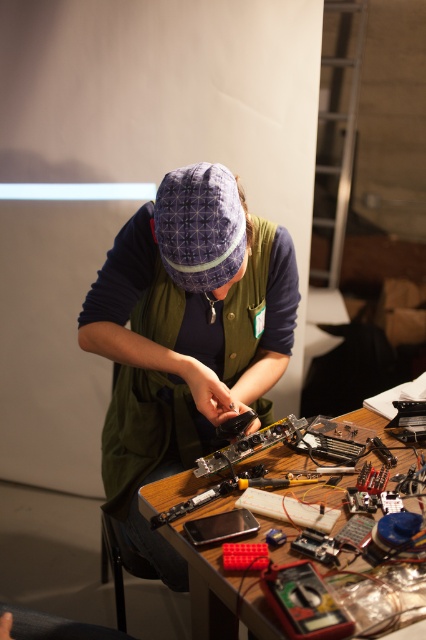
Question: Where is purple fabric cap at upper center located in relation to wooden table at center in the image?

Choices:
 (A) below
 (B) above

Answer: (B)

Question: Where is purple fabric cap at upper center located in relation to wooden table at center in the image?

Choices:
 (A) right
 (B) left

Answer: (B)

Question: Does purple fabric cap at upper center have a smaller size compared to wooden table at center?

Choices:
 (A) no
 (B) yes

Answer: (A)

Question: Which point is farther to the camera?

Choices:
 (A) (203, 570)
 (B) (126, 250)

Answer: (B)